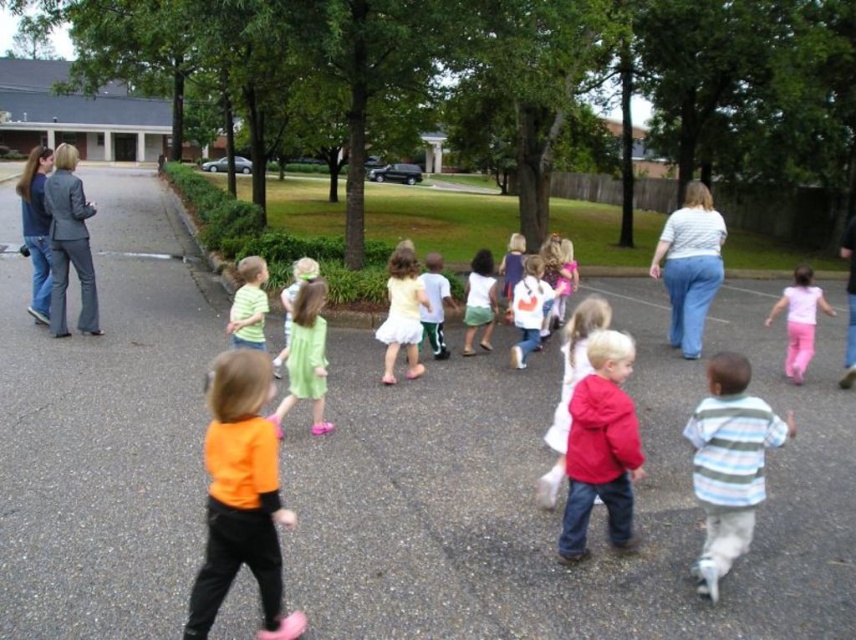
Question: Which of the following is the closest to the observer?

Choices:
 (A) (399, 337)
 (B) (66, 177)
 (C) (306, 380)
 (D) (531, 256)

Answer: (C)

Question: Based on their relative distances, which object is farther from the light green fabric dress at center?

Choices:
 (A) matte gray blazer at left
 (B) orange matte shirt at center
 (C) matte red hoodie at center

Answer: (B)

Question: Can you confirm if white matte shirt at center is wider than white cotton shirt at center?

Choices:
 (A) yes
 (B) no

Answer: (B)

Question: Is white cotton shirt at center smaller than matte green shirt at center?

Choices:
 (A) no
 (B) yes

Answer: (A)

Question: Estimate the real-world distances between objects in this image. Which object is farther from the striped cotton shirt at lower right?

Choices:
 (A) green cotton dress at center
 (B) white matte dress at center

Answer: (B)

Question: Does matte gray blazer at left come in front of pink cotton pants at right?

Choices:
 (A) no
 (B) yes

Answer: (B)